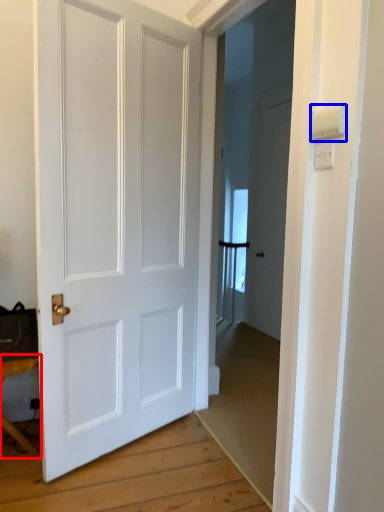
Question: Among these objects, which one is nearest to the camera, table (highlighted by a red box) or light switch (highlighted by a blue box)?

Choices:
 (A) table
 (B) light switch

Answer: (B)